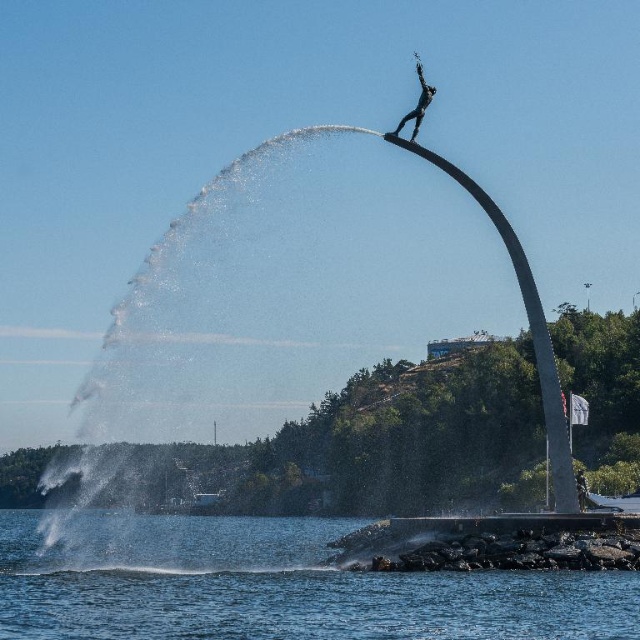
You are a park visitor who wants to take a photo of the polished bronze statue at upper center without the clear water at lower center appearing in the frame. Given that your camera has a fixed focal length and you can only move forward or backward, can you estimate whether moving closer to the statue would help achieve this?

The clear water at lower center and polished bronze statue at upper center are 191.74 feet apart. Moving closer to the statue would bring both objects closer to the camera, but since they are 191.74 feet apart, it might be challenging to frame the statue without the water unless you position yourself far enough back to compress the perspective, making the distance between them appear smaller. However, at such a large separation, moving closer might not sufficiently reduce the water visibility. A better bet,

You are standing at the edge of the water and want to take a photo of the polished bronze statue at upper center without the clear water at lower center appearing in the frame. Is it possible to do so by adjusting your position?

The clear water at lower center is located below the polished bronze statue at upper center. By positioning yourself higher or angling the camera upwards, you can frame the shot to exclude the clear water at lower center while capturing the polished bronze statue at upper center.